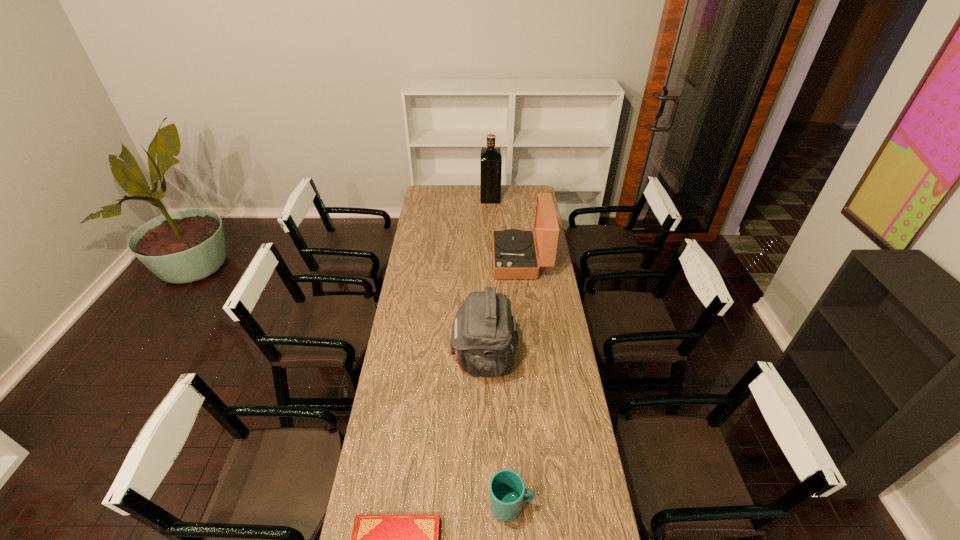
You are a GUI agent. You are given a task and a screenshot of the screen. Output one action in this format:
    pyautogui.click(x=<x>, y=<y>)
    Task: Click on the free spot between the phonograph record and the tallest object
    
    Given the screenshot: What is the action you would take?
    pyautogui.click(x=505, y=228)

Find the location of a particular element. This screenshot has width=960, height=540. free area in between the farthest object and the fourth nearest object is located at coordinates (505, 228).

The width and height of the screenshot is (960, 540). Identify the location of free space between the shoulder bag and the cup. (497, 431).

Where is `free space between the liquor and the fourth nearest object`? free space between the liquor and the fourth nearest object is located at coordinates (505, 228).

Identify the location of the second closest object to the shortest object. The width and height of the screenshot is (960, 540). (484, 337).

The width and height of the screenshot is (960, 540). Identify the location of object that stands as the fourth closest to the fourth nearest object. (376, 539).